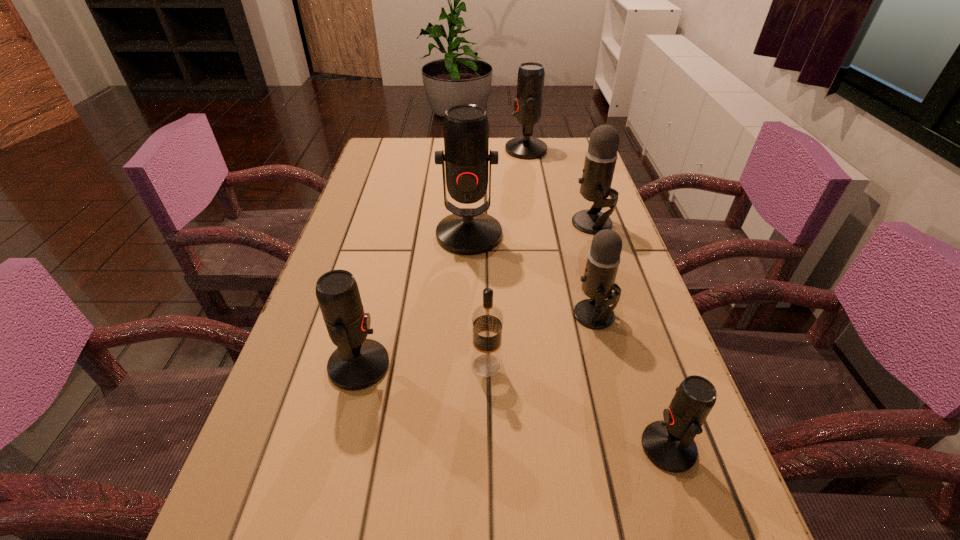
In order to click on the second farthest red microphone in this screenshot , I will do `click(468, 231)`.

Where is `the tallest object`? This screenshot has height=540, width=960. the tallest object is located at coordinates (468, 231).

What are the coordinates of `the second biggest red microphone` in the screenshot? It's located at (530, 84).

You are a GUI agent. You are given a task and a screenshot of the screen. Output one action in this format:
    pyautogui.click(x=<x>, y=<y>)
    Task: Click on the second red microphone from right to left
    The height and width of the screenshot is (540, 960).
    Given the screenshot: What is the action you would take?
    pyautogui.click(x=530, y=84)

I want to click on the bigger gray microphone, so click(x=601, y=155).

Identify the location of the leftmost red microphone. This screenshot has height=540, width=960. (358, 363).

Where is `the third farthest red microphone`? The height and width of the screenshot is (540, 960). the third farthest red microphone is located at coordinates [358, 363].

You are a GUI agent. You are given a task and a screenshot of the screen. Output one action in this format:
    pyautogui.click(x=<x>, y=<y>)
    Task: Click on the third nearest microphone
    The image size is (960, 540).
    Given the screenshot: What is the action you would take?
    pyautogui.click(x=603, y=259)

Locate an element on the screen. The height and width of the screenshot is (540, 960). the nearer gray microphone is located at coordinates (603, 259).

You are a GUI agent. You are given a task and a screenshot of the screen. Output one action in this format:
    pyautogui.click(x=<x>, y=<y>)
    Task: Click on the vodka
    
    Given the screenshot: What is the action you would take?
    pyautogui.click(x=487, y=320)